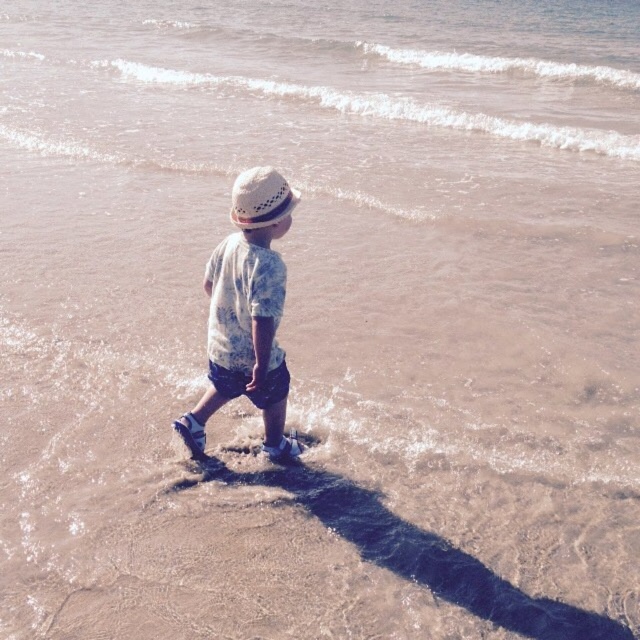
Question: Among these objects, which one is nearest to the camera?

Choices:
 (A) light blue cotton shirt at center
 (B) white woven hat at center

Answer: (A)

Question: Can you confirm if light blue cotton shirt at center is positioned below white woven hat at center?

Choices:
 (A) no
 (B) yes

Answer: (B)

Question: Is light blue cotton shirt at center closer to the viewer compared to white woven hat at center?

Choices:
 (A) yes
 (B) no

Answer: (A)

Question: Is light blue cotton shirt at center above white woven hat at center?

Choices:
 (A) yes
 (B) no

Answer: (B)